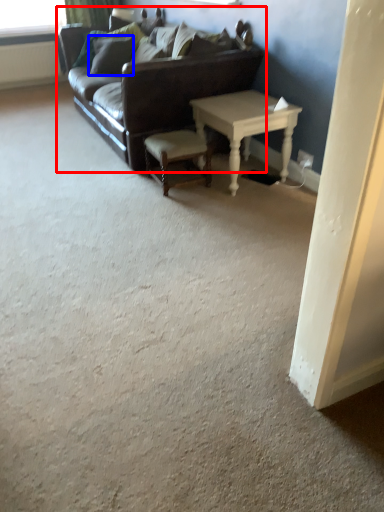
Question: Which point is further to the camera, studio couch (highlighted by a red box) or pillow (highlighted by a blue box)?

Choices:
 (A) studio couch
 (B) pillow

Answer: (B)